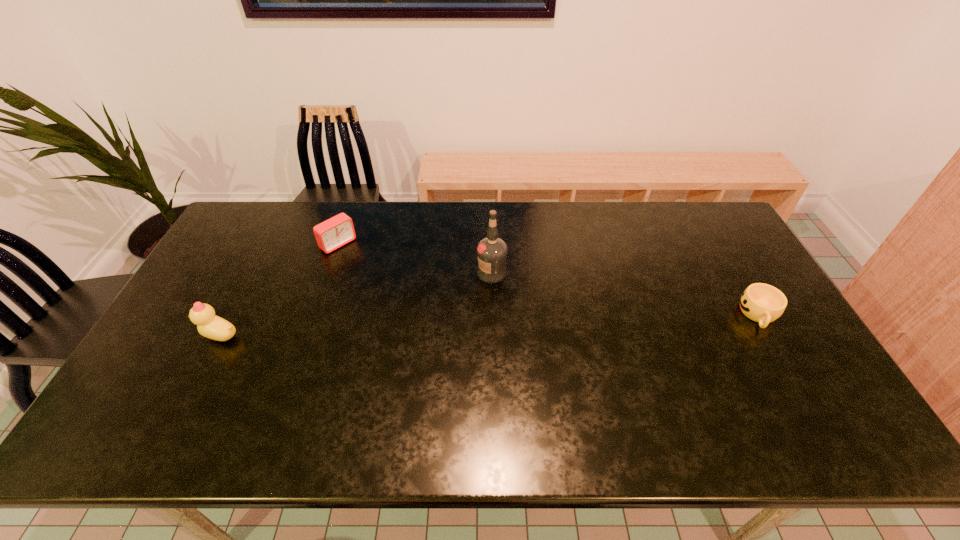
Identify the location of free spot between the rightmost object and the tallest object. This screenshot has width=960, height=540. (625, 294).

This screenshot has height=540, width=960. I want to click on unoccupied area between the alarm clock and the cup, so click(x=549, y=280).

What are the coordinates of `free area in between the shortest object and the alarm clock` in the screenshot? It's located at (549, 280).

Locate an element on the screen. the closest object relative to the duckling is located at coordinates (337, 231).

Where is `object that is the second closest to the rightmost object`? The height and width of the screenshot is (540, 960). object that is the second closest to the rightmost object is located at coordinates (337, 231).

You are a GUI agent. You are given a task and a screenshot of the screen. Output one action in this format:
    pyautogui.click(x=<x>, y=<y>)
    Task: Click on the vacant region that satisfies the following two spatial constraints: 1. on the front side of the second object from left to right; 2. on the right side of the vodka
    The image size is (960, 540).
    Given the screenshot: What is the action you would take?
    pyautogui.click(x=328, y=273)